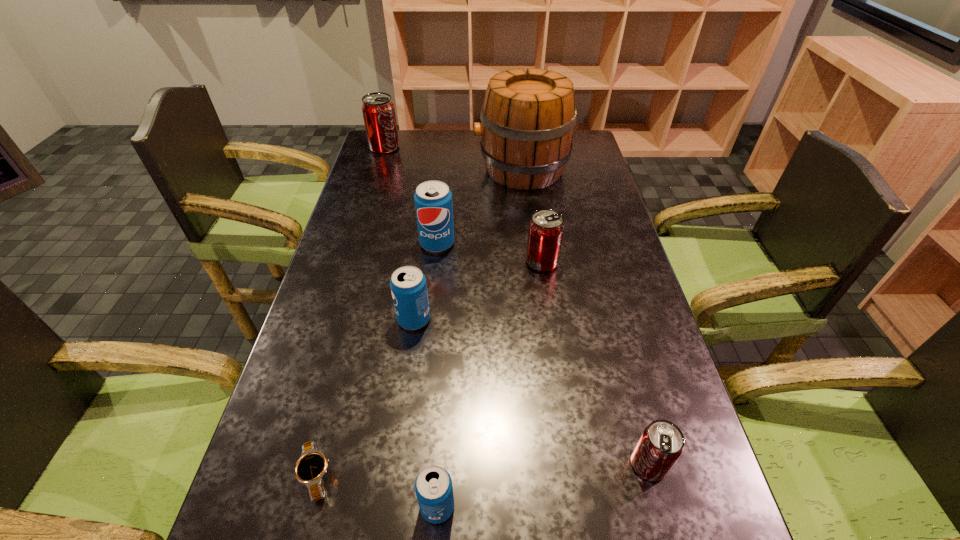
Locate an element on the screen. This screenshot has height=540, width=960. blue soda can that is the closest one to the shortest object is located at coordinates (433, 486).

Identify which blue soda can is the second nearest to the smallest red pop soda. Please provide its 2D coordinates. Your answer should be formatted as a tuple, i.e. [(x, y)], where the tuple contains the x and y coordinates of a point satisfying the conditions above.

[(408, 285)]

Locate an element on the screen. The image size is (960, 540). vacant area in the image that satisfies the following two spatial constraints: 1. on the back side of the second farthest red pop soda; 2. on the right side of the watch is located at coordinates (371, 262).

This screenshot has width=960, height=540. Find the location of `free spot that satisfies the following two spatial constraints: 1. on the back side of the black watch; 2. on the right side of the second smallest red pop soda`. free spot that satisfies the following two spatial constraints: 1. on the back side of the black watch; 2. on the right side of the second smallest red pop soda is located at coordinates (371, 262).

Identify the location of free space in the image that satisfies the following two spatial constraints: 1. on the back side of the second biggest red pop soda; 2. on the side of the tallest object where the spigot is located. (529, 170).

The height and width of the screenshot is (540, 960). Find the location of `blank space that satisfies the following two spatial constraints: 1. on the side of the cider where the spigot is located; 2. on the back side of the second biggest red pop soda`. blank space that satisfies the following two spatial constraints: 1. on the side of the cider where the spigot is located; 2. on the back side of the second biggest red pop soda is located at coordinates (533, 262).